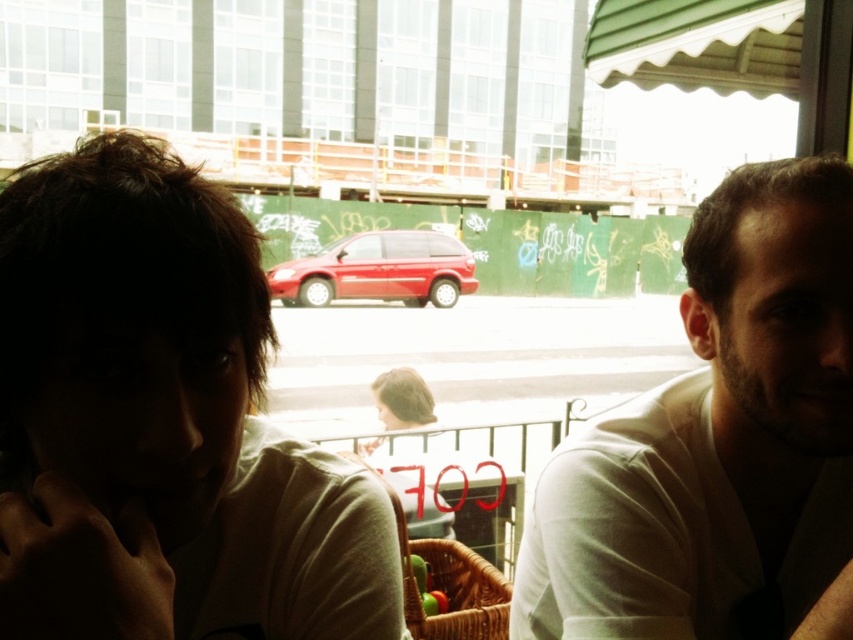
Question: Can you confirm if white matte shirt at right is smaller than blonde hair at center?

Choices:
 (A) yes
 (B) no

Answer: (B)

Question: Which point appears farthest from the camera in this image?

Choices:
 (A) (299, 260)
 (B) (575, 516)

Answer: (A)

Question: Among these objects, which one is farthest from the camera?

Choices:
 (A) white matte shirt at right
 (B) blonde hair at center
 (C) matte red van at center

Answer: (C)

Question: Does matte red van at center have a larger size compared to blonde hair at center?

Choices:
 (A) yes
 (B) no

Answer: (A)

Question: Is matte red van at center above blonde hair at center?

Choices:
 (A) no
 (B) yes

Answer: (B)

Question: Based on their relative distances, which object is nearer to the matte red van at center?

Choices:
 (A) white matte shirt at right
 (B) blonde hair at center

Answer: (B)